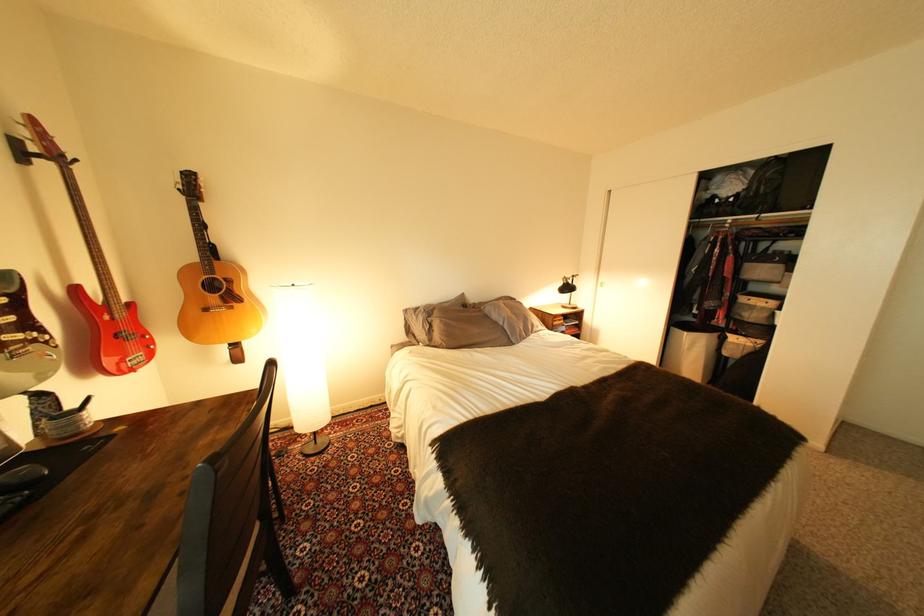
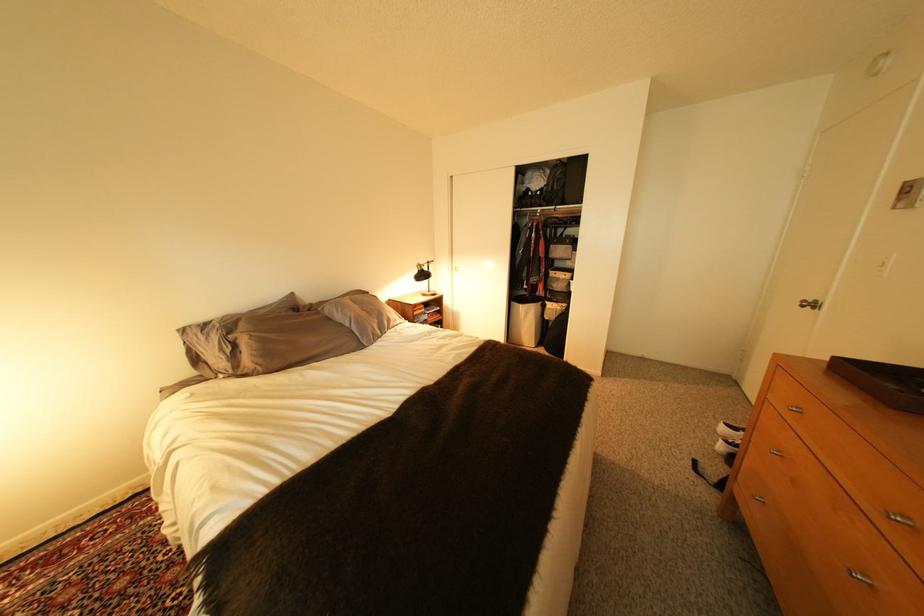
Where in the second image is the point corresponding to point 574,286 from the first image?

(429, 273)